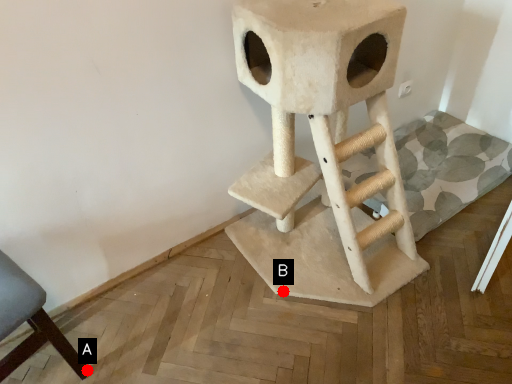
Question: Two points are circled on the image, labeled by A and B beside each circle. Which point is farther to the camera?

Choices:
 (A) A is further
 (B) B is further

Answer: (B)